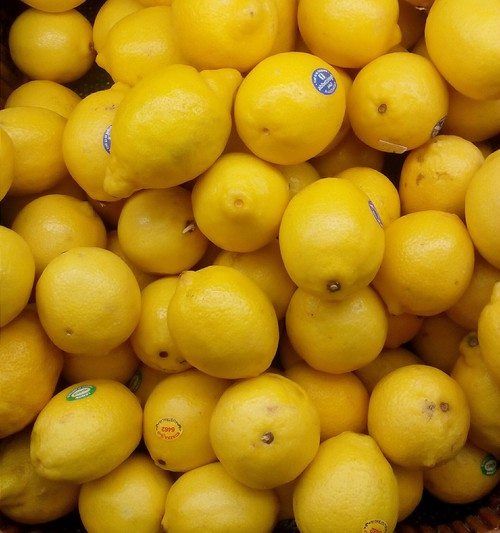
Identify the location of stickers. Image resolution: width=500 pixels, height=533 pixels. (169, 428), (377, 520), (488, 466), (75, 397), (137, 378), (372, 207), (323, 80), (436, 123), (106, 138).